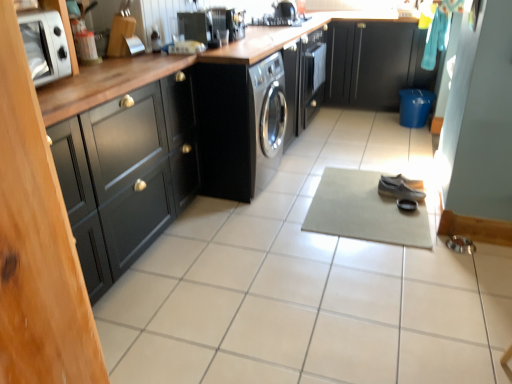
Identify the location of free space in front of satin black washing machine at center. (244, 218).